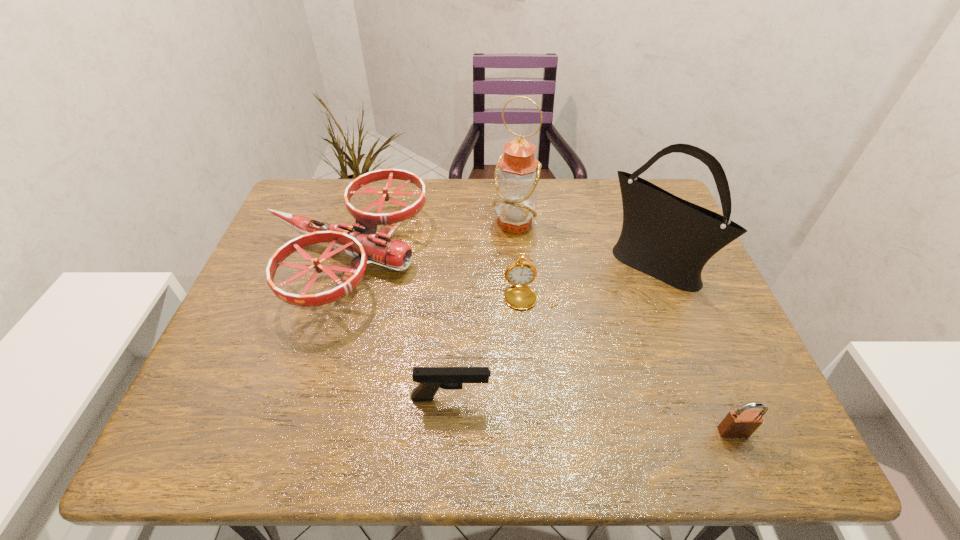
Where is `unoccupied position between the leftmost object and the pocket watch`? unoccupied position between the leftmost object and the pocket watch is located at coordinates (438, 276).

Where is `the third closest object relative to the pistol`? the third closest object relative to the pistol is located at coordinates (666, 237).

Find the location of `object that can be found as the fifth closest to the pocket watch`. object that can be found as the fifth closest to the pocket watch is located at coordinates (741, 423).

This screenshot has width=960, height=540. In order to click on vacant space that satisfies the following two spatial constraints: 1. on the front side of the shoulder bag; 2. on the front-facing side of the fifth farthest object in this screenshot , I will do `click(703, 398)`.

Where is `free space that satisfies the following two spatial constraints: 1. on the face of the pocket watch; 2. on the front-facing side of the second object from left to right`? free space that satisfies the following two spatial constraints: 1. on the face of the pocket watch; 2. on the front-facing side of the second object from left to right is located at coordinates (541, 398).

Identify the location of vacant region that satisfies the following two spatial constraints: 1. on the back side of the oil lamp; 2. on the left side of the drone. This screenshot has width=960, height=540. (355, 224).

Identify the location of free space in the image that satisfies the following two spatial constraints: 1. on the face of the pocket watch; 2. on the front-facing side of the fifth object from right to left. (541, 398).